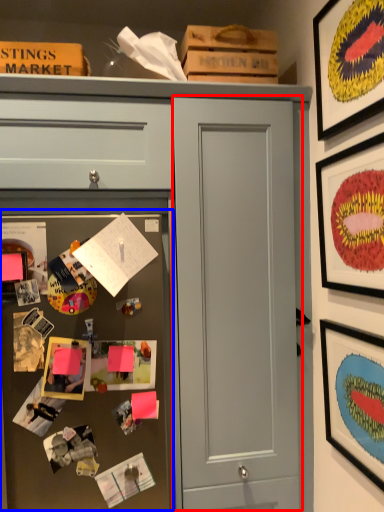
Question: Which of the following is the farthest to the observer, door (highlighted by a red box) or fridge (highlighted by a blue box)?

Choices:
 (A) door
 (B) fridge

Answer: (A)